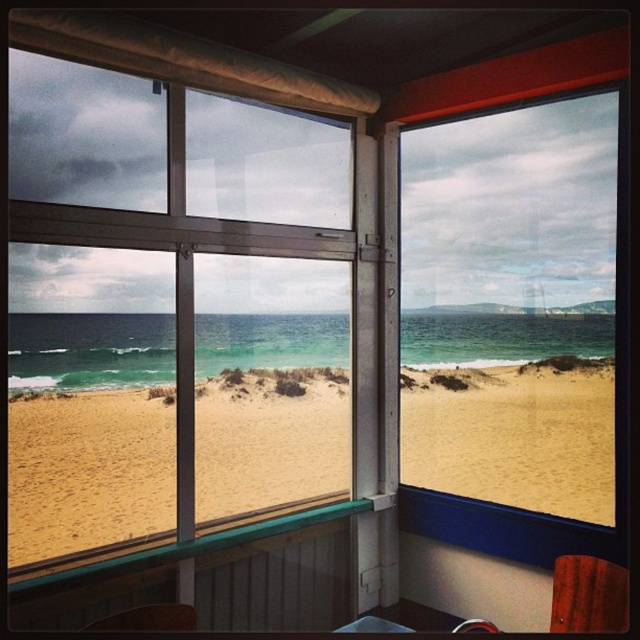
Question: Which object is the closest to the matte black chair at lower left?

Choices:
 (A) wooden chair at lower right
 (B) transparent glass window at center
 (C) yellow sand at center

Answer: (B)

Question: Is wooden chair at lower right in front of matte black chair at lower left?

Choices:
 (A) yes
 (B) no

Answer: (B)

Question: Is transparent glass window at center further to camera compared to wooden chair at lower right?

Choices:
 (A) yes
 (B) no

Answer: (A)

Question: Which point is closer to the camera taking this photo?

Choices:
 (A) (572, 604)
 (B) (184, 611)
 (C) (177, 88)
 (D) (545, 378)

Answer: (B)

Question: Which of the following is the closest to the observer?

Choices:
 (A) (522, 438)
 (B) (579, 584)
 (C) (128, 630)

Answer: (C)

Question: Can you confirm if transparent glass window at center is positioned below matte black chair at lower left?

Choices:
 (A) no
 (B) yes

Answer: (A)